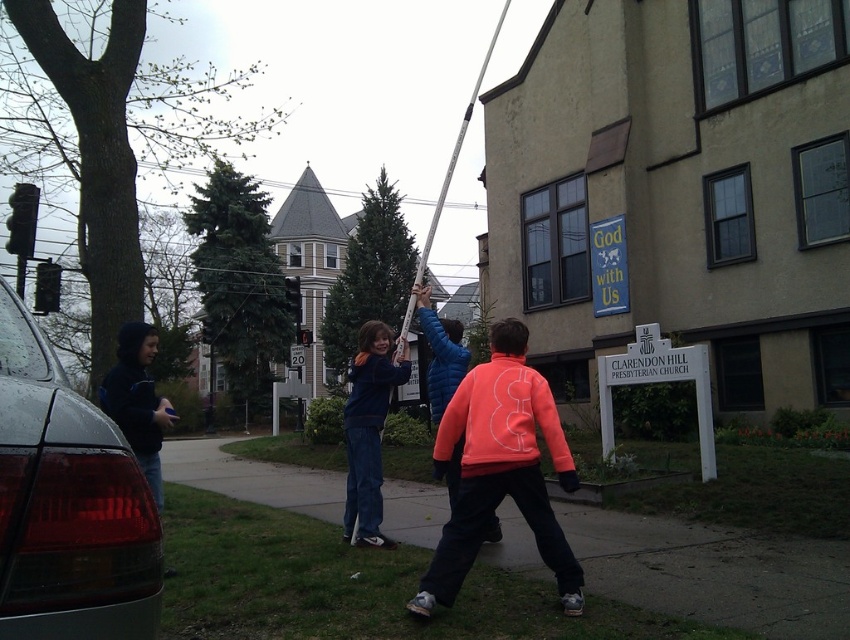
Question: Is orange fleece jacket at center positioned behind dark blue hoodie at left?

Choices:
 (A) no
 (B) yes

Answer: (A)

Question: Among these points, which one is farthest from the camera?

Choices:
 (A) (31, 403)
 (B) (408, 538)

Answer: (B)

Question: Is orange fleece jacket at center to the right of dark blue hoodie at left from the viewer's perspective?

Choices:
 (A) no
 (B) yes

Answer: (B)

Question: Which of the following is the closest to the observer?

Choices:
 (A) smooth concrete sidewalk at center
 (B) orange fleece jacket at center

Answer: (A)

Question: Which of the following is the farthest from the observer?

Choices:
 (A) (408, 604)
 (B) (378, 444)

Answer: (B)

Question: Observing the image, what is the correct spatial positioning of smooth concrete sidewalk at center in reference to dark blue hoodie at left?

Choices:
 (A) above
 (B) below

Answer: (B)